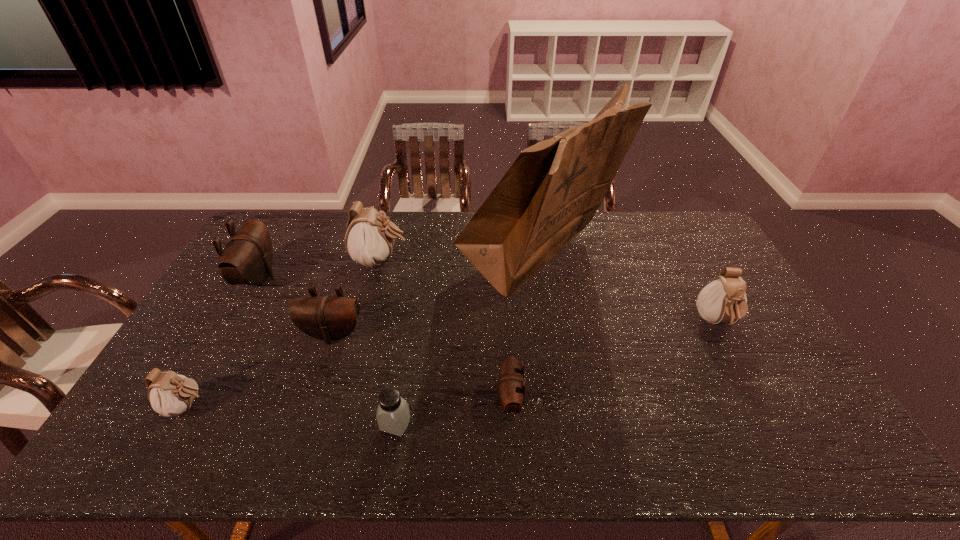
Find the location of a particular element. vacant space positioned on the front-facing side of the smallest white pouch is located at coordinates tap(283, 407).

Where is `vacant position located 0.140m with the flap open on the smallest brown pouch`? The width and height of the screenshot is (960, 540). vacant position located 0.140m with the flap open on the smallest brown pouch is located at coordinates (441, 401).

Find the location of a particular element. The width and height of the screenshot is (960, 540). vacant space located 0.120m with the flap open on the smallest brown pouch is located at coordinates (448, 401).

This screenshot has height=540, width=960. Find the location of `free region located with the flap open on the smallest brown pouch`. free region located with the flap open on the smallest brown pouch is located at coordinates (347, 401).

You are a GUI agent. You are given a task and a screenshot of the screen. Output one action in this format:
    pyautogui.click(x=<x>, y=<y>)
    Task: Click on the free space located 0.300m on the left of the saltshaker
    The height and width of the screenshot is (540, 960).
    Given the screenshot: What is the action you would take?
    pyautogui.click(x=258, y=424)

At what (x,y) coordinates should I click in order to perform the action: click on grocery bag present at the far edge. Please return your answer as a coordinate pair (x, y). This screenshot has width=960, height=540. Looking at the image, I should click on (550, 193).

The width and height of the screenshot is (960, 540). I want to click on pouch that is positioned at the far edge, so click(369, 240).

Image resolution: width=960 pixels, height=540 pixels. What are the coordinates of `object present at the near edge` in the screenshot? It's located at (393, 415).

Locate an element on the screen. The height and width of the screenshot is (540, 960). object at the right edge is located at coordinates (723, 300).

Locate an element on the screen. The width and height of the screenshot is (960, 540). vacant space at the far edge is located at coordinates (309, 245).